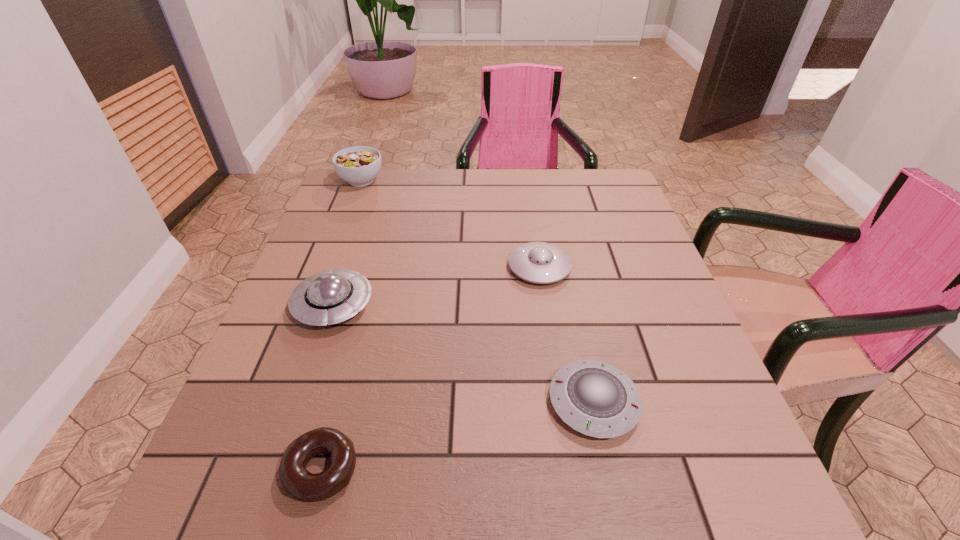
In order to click on soup bowl present at the left edge in this screenshot , I will do `click(359, 166)`.

Locate an element on the screen. Image resolution: width=960 pixels, height=540 pixels. saucer that is at the left edge is located at coordinates (329, 297).

Find the location of a particular element. Image resolution: width=960 pixels, height=540 pixels. doughnut positioned at the left edge is located at coordinates (295, 480).

Identify the location of object positioned at the right edge. This screenshot has width=960, height=540. (594, 398).

Identify the location of object that is at the far left corner. (359, 166).

Where is `object that is at the near left corner`? object that is at the near left corner is located at coordinates (295, 480).

Where is `free space at the far edge of the desktop`? free space at the far edge of the desktop is located at coordinates (467, 180).

The height and width of the screenshot is (540, 960). In order to click on free space at the near edge of the desktop in this screenshot , I will do `click(499, 525)`.

Locate an element on the screen. The width and height of the screenshot is (960, 540). free point at the left edge is located at coordinates (294, 388).

What are the coordinates of `vacant space at the right edge of the desktop` in the screenshot? It's located at (626, 373).